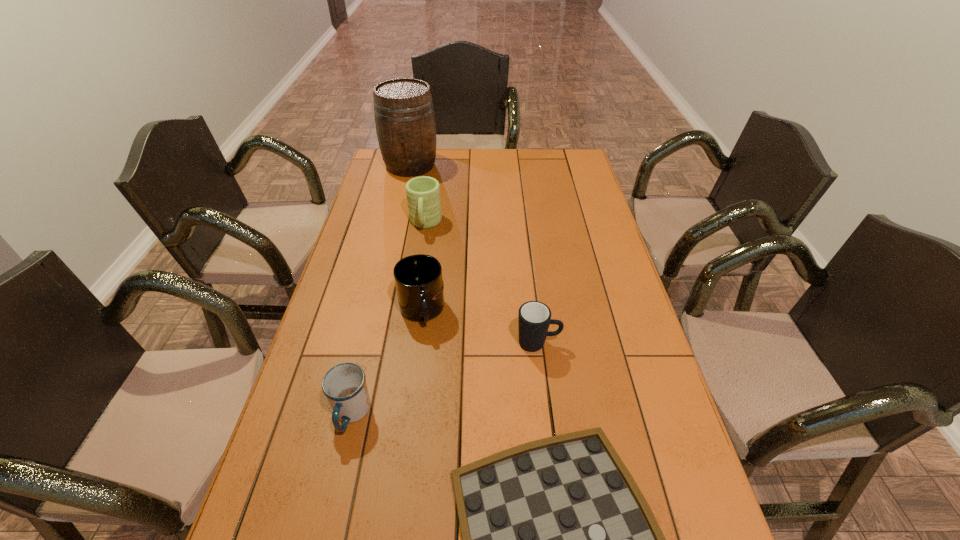
Locate which mug is the third closest to the farthest mug. Please provide its 2D coordinates. Your answer should be formatted as a tuple, i.e. [(x, y)], where the tuple contains the x and y coordinates of a point satisfying the conditions above.

[(344, 385)]

At what (x,y) coordinates should I click in order to perform the action: click on mug that can be found as the fourth closest to the shortest object. Please return your answer as a coordinate pair (x, y). This screenshot has height=540, width=960. Looking at the image, I should click on (423, 193).

Find the location of a particular element. Image resolution: width=960 pixels, height=540 pixels. free space that satisfies the following two spatial constraints: 1. on the side of the rightmost mug with the handle; 2. on the handle side of the nearest mug is located at coordinates (547, 414).

Identify the location of vacant point that satisfies the following two spatial constraints: 1. on the side of the rightmost mug with the handle; 2. on the handle side of the nearest mug. The height and width of the screenshot is (540, 960). (547, 414).